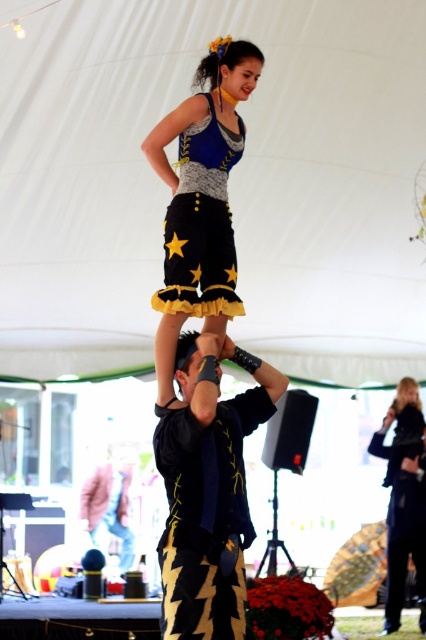
You are a photographer at the event and want to capture a photo of both the shiny blue fabric dress at center and the blue denim dress at center. Based on their positions, which dress should you focus on first to ensure it appears in the foreground of the photo?

The shiny blue fabric dress at center is taller than the blue denim dress at center, so focusing on the shiny blue fabric dress at center first will ensure it appears in the foreground.

You are a photographer standing at the edge of the tent, wanting to capture both the shiny blue fabric dress at center and the blue denim dress at center in the same frame. Given that your camera has a minimum focus distance of 2 inches, will you be able to focus on both dresses simultaneously?

The shiny blue fabric dress at center and blue denim dress at center are 1.94 inches apart, which is less than the camera minimum focus distance of 2 inches. Therefore, the camera can focus on both dresses at the same time.